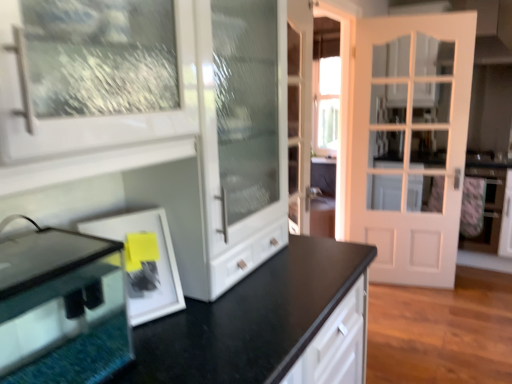
The image size is (512, 384). What do you see at coordinates (409, 142) in the screenshot?
I see `white matte door at right` at bounding box center [409, 142].

This screenshot has width=512, height=384. What are the coordinates of `clear glass fish tank at lower left` in the screenshot? It's located at (62, 308).

Image resolution: width=512 pixels, height=384 pixels. Describe the element at coordinates (144, 261) in the screenshot. I see `white matte picture frame at lower left` at that location.

Image resolution: width=512 pixels, height=384 pixels. Find the location of `white matte door at right`. white matte door at right is located at coordinates (409, 142).

In the scene shown: Between white matte picture frame at lower left and white matte door at right, which one has larger size?

white matte door at right.

From the image's perspective, which one is positioned lower, white matte picture frame at lower left or white matte door at right?

white matte picture frame at lower left.

Can you see white matte picture frame at lower left touching white matte door at right?

white matte picture frame at lower left is not next to white matte door at right, and they're not touching.

Does white matte picture frame at lower left appear on the right side of clear glass fish tank at lower left?

Yes.

Is white matte picture frame at lower left aimed at clear glass fish tank at lower left?

No, white matte picture frame at lower left is not turned towards clear glass fish tank at lower left.

In the scene shown: From the image's perspective, relative to clear glass fish tank at lower left, is white matte picture frame at lower left above or below?

white matte picture frame at lower left is situated higher than clear glass fish tank at lower left in the image.

The image size is (512, 384). In order to click on picture frame that is under the clear glass fish tank at lower left (from a real-world perspective) in this screenshot , I will do `click(144, 261)`.

Does clear glass fish tank at lower left have a greater height compared to white matte door at right?

No, clear glass fish tank at lower left is not taller than white matte door at right.

Is point (109, 287) positioned behind point (419, 154)?

No, it is in front of (419, 154).

From a real-world perspective, which object stands above the other?

In real-world perspective, clear glass fish tank at lower left is above.

Based on their positions, is clear glass fish tank at lower left located to the left or right of white matte picture frame at lower left?

clear glass fish tank at lower left is positioned on white matte picture frame at lower left's left side.

At what (x,y) coordinates should I click in order to perform the action: click on picture frame above the clear glass fish tank at lower left (from the image's perspective). Please return your answer as a coordinate pair (x, y). Image resolution: width=512 pixels, height=384 pixels. Looking at the image, I should click on (144, 261).

From a real-world perspective, is clear glass fish tank at lower left under white matte picture frame at lower left?

No, from a real-world perspective, clear glass fish tank at lower left is not beneath white matte picture frame at lower left.

How different are the orientations of white matte door at right and white matte picture frame at lower left in degrees?

There is a 51-degree angle between the facing directions of white matte door at right and white matte picture frame at lower left.

Considering the points (459, 216) and (131, 258), which point is behind, point (459, 216) or point (131, 258)?

Point (459, 216)

Looking at this image, between white matte door at right and white matte picture frame at lower left, which one has smaller width?

Thinner between the two is white matte door at right.

Is white matte door at right directly adjacent to white matte picture frame at lower left?

No, white matte door at right is not next to white matte picture frame at lower left.

Considering the relative sizes of white matte door at right and clear glass fish tank at lower left in the image provided, is white matte door at right taller than clear glass fish tank at lower left?

Yes.

Is white matte door at right positioned beyond the bounds of clear glass fish tank at lower left?

white matte door at right lies outside clear glass fish tank at lower left's area.

Where is `door above the clear glass fish tank at lower left (from the image's perspective)`? This screenshot has width=512, height=384. door above the clear glass fish tank at lower left (from the image's perspective) is located at coordinates (409, 142).

Is white matte door at right not close to clear glass fish tank at lower left?

Yes, white matte door at right and clear glass fish tank at lower left are quite far apart.

At what (x,y) coordinates should I click in order to perform the action: click on picture frame above the white matte door at right (from a real-world perspective). Please return your answer as a coordinate pair (x, y). Looking at the image, I should click on [144, 261].

Find the location of a particular element. This screenshot has width=512, height=384. picture frame below the clear glass fish tank at lower left (from a real-world perspective) is located at coordinates (144, 261).

Looking at the image, which one is located further to white matte picture frame at lower left, white matte door at right or clear glass fish tank at lower left?

white matte door at right lies further to white matte picture frame at lower left than the other object.

From the image, which object appears to be farther from clear glass fish tank at lower left, white matte door at right or white matte picture frame at lower left?

white matte door at right lies further to clear glass fish tank at lower left than the other object.

Based on their spatial positions, is clear glass fish tank at lower left or white matte door at right closer to white matte picture frame at lower left?

clear glass fish tank at lower left lies closer to white matte picture frame at lower left than the other object.

Consider the image. When comparing their distances from white matte door at right, does white matte picture frame at lower left or clear glass fish tank at lower left seem closer?

white matte picture frame at lower left lies closer to white matte door at right than the other object.

Based on their spatial positions, is clear glass fish tank at lower left or white matte picture frame at lower left further from white matte door at right?

clear glass fish tank at lower left is further to white matte door at right.

Looking at the image, which one is located further to clear glass fish tank at lower left, white matte picture frame at lower left or white matte door at right?

white matte door at right is further to clear glass fish tank at lower left.

Where is `picture frame positioned between clear glass fish tank at lower left and white matte door at right from near to far`? picture frame positioned between clear glass fish tank at lower left and white matte door at right from near to far is located at coordinates (144, 261).